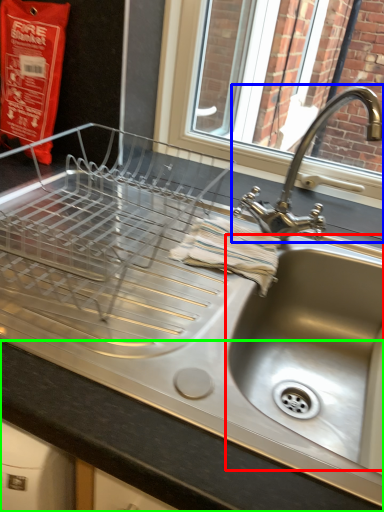
Question: Which object is the farthest from sink (highlighted by a red box)? Choose among these: tap (highlighted by a blue box) or counter top (highlighted by a green box).

Choices:
 (A) tap
 (B) counter top

Answer: (B)